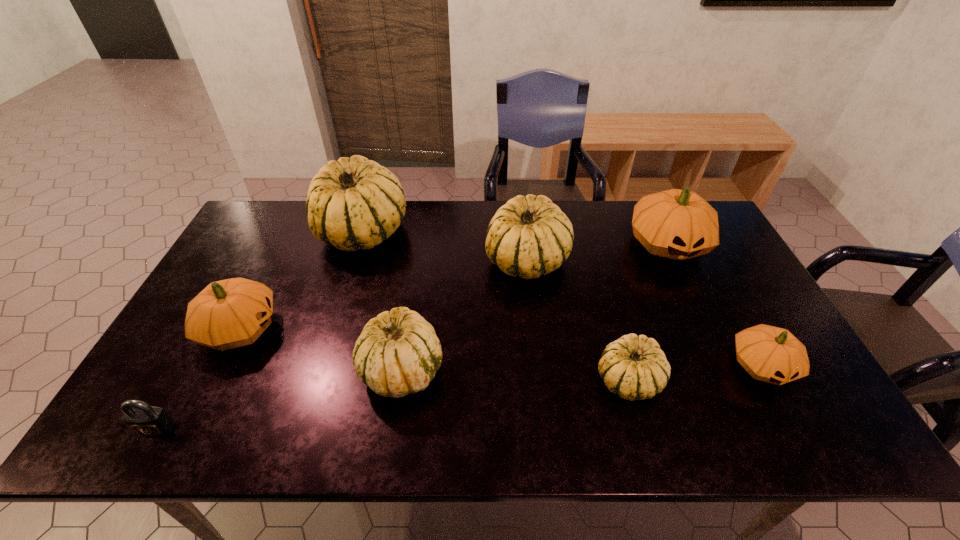
Locate an element on the screen. This screenshot has width=960, height=540. padlock present at the left edge is located at coordinates (140, 417).

Locate an element on the screen. This screenshot has width=960, height=540. object situated at the near left corner is located at coordinates (140, 417).

Image resolution: width=960 pixels, height=540 pixels. Identify the location of object that is positioned at the far right corner. point(678,224).

Where is `vacant space at the far edge of the desktop`? vacant space at the far edge of the desktop is located at coordinates (612, 210).

In the image, there is a desktop. Identify the location of vacant space at the near edge. The image size is (960, 540). (275, 411).

You are a GUI agent. You are given a task and a screenshot of the screen. Output one action in this format:
    pyautogui.click(x=<x>, y=<y>)
    Task: Click on the vacant region at the right edge of the desktop
    
    Given the screenshot: What is the action you would take?
    pyautogui.click(x=757, y=304)

You are a GUI agent. You are given a task and a screenshot of the screen. Output one action in this format:
    pyautogui.click(x=<x>, y=<y>)
    Task: Click on the vacant space that is in between the padlock and the second biggest orange gourd
    
    Given the screenshot: What is the action you would take?
    pyautogui.click(x=198, y=379)

Find the location of a particular element. This screenshot has height=540, width=960. vacant point located between the second smallest white gourd and the gray padlock is located at coordinates (278, 399).

This screenshot has height=540, width=960. I want to click on free area in between the fourth object from right to left and the sixth object from left to right, so click(x=578, y=320).

Where is `free space between the smallest orange gourd and the second smallest orange gourd`? The width and height of the screenshot is (960, 540). free space between the smallest orange gourd and the second smallest orange gourd is located at coordinates (501, 347).